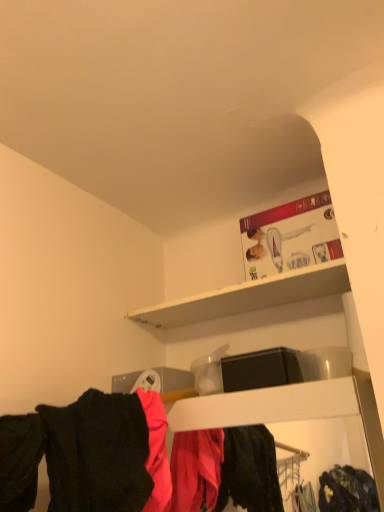
Question: Can you confirm if matte black clothing at lower center is wider than white matte shelf at upper center?

Choices:
 (A) no
 (B) yes

Answer: (B)

Question: Is the position of matte black clothing at lower center less distant than that of white matte shelf at upper center?

Choices:
 (A) yes
 (B) no

Answer: (A)

Question: Are matte black clothing at lower center and white matte shelf at upper center far apart?

Choices:
 (A) no
 (B) yes

Answer: (A)

Question: Considering the relative sizes of matte black clothing at lower center and white matte shelf at upper center in the image provided, is matte black clothing at lower center smaller than white matte shelf at upper center?

Choices:
 (A) no
 (B) yes

Answer: (A)

Question: Is matte black clothing at lower center touching white matte shelf at upper center?

Choices:
 (A) yes
 (B) no

Answer: (B)

Question: From a real-world perspective, relative to black matte shirt at lower left, is white matte shelf at upper center vertically above or below?

Choices:
 (A) above
 (B) below

Answer: (A)

Question: Would you say white matte shelf at upper center is inside or outside black matte shirt at lower left?

Choices:
 (A) inside
 (B) outside

Answer: (B)

Question: From the image's perspective, relative to black matte shirt at lower left, is white matte shelf at upper center above or below?

Choices:
 (A) below
 (B) above

Answer: (B)

Question: Considering the positions of white matte shelf at upper center and black matte shirt at lower left in the image, is white matte shelf at upper center taller or shorter than black matte shirt at lower left?

Choices:
 (A) tall
 (B) short

Answer: (B)

Question: Is matte black clothing at lower center wider or thinner than black matte shirt at lower left?

Choices:
 (A) wide
 (B) thin

Answer: (B)

Question: In terms of height, does matte black clothing at lower center look taller or shorter compared to black matte shirt at lower left?

Choices:
 (A) tall
 (B) short

Answer: (A)

Question: Considering the positions of matte black clothing at lower center and black matte shirt at lower left in the image, is matte black clothing at lower center bigger or smaller than black matte shirt at lower left?

Choices:
 (A) small
 (B) big

Answer: (B)

Question: Considering their positions, is matte black clothing at lower center located in front of or behind black matte shirt at lower left?

Choices:
 (A) front
 (B) behind

Answer: (B)

Question: Is matte black clothing at lower center situated inside white matte shelf at upper center or outside?

Choices:
 (A) inside
 (B) outside

Answer: (B)

Question: Based on their positions, is matte black clothing at lower center located to the left or right of white matte shelf at upper center?

Choices:
 (A) right
 (B) left

Answer: (A)